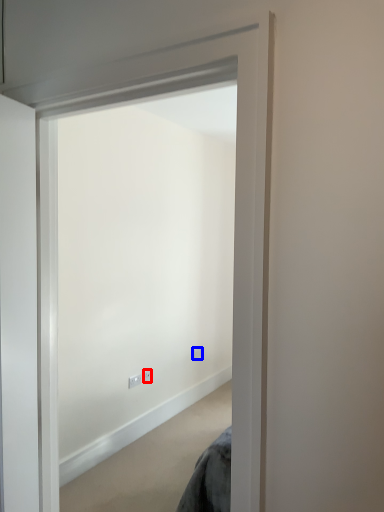
Question: Which of the following is the farthest to the observer, electric outlet (highlighted by a red box) or electric outlet (highlighted by a blue box)?

Choices:
 (A) electric outlet
 (B) electric outlet

Answer: (B)